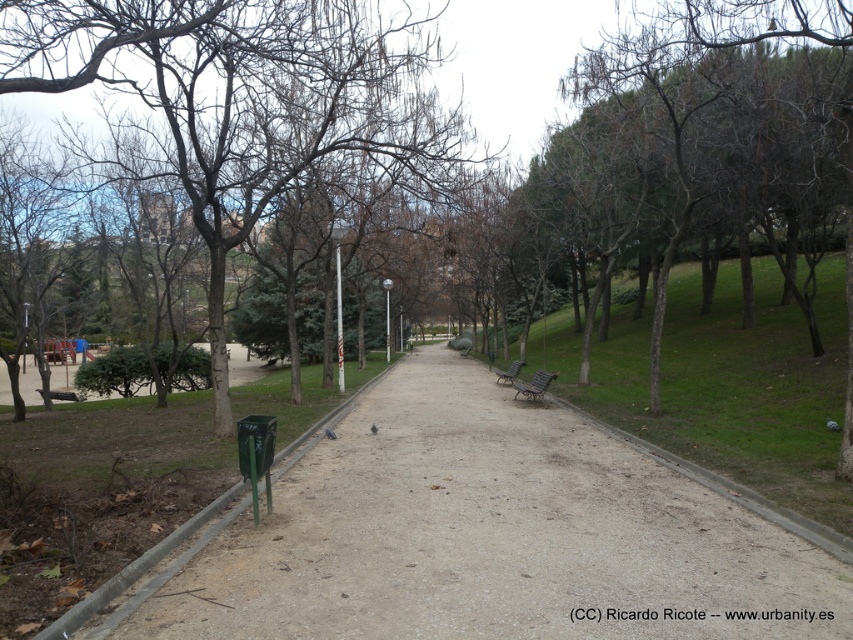
Does metallic silver bench at center appear over green metallic bench at center-right?

Incorrect, metallic silver bench at center is not positioned above green metallic bench at center-right.

Is point (537, 388) positioned before point (514, 364)?

Yes.

This screenshot has width=853, height=640. In order to click on metallic silver bench at center in this screenshot , I will do `click(534, 385)`.

Does brown leafless tree at center appear under green metallic bench at center-right?

Actually, brown leafless tree at center is above green metallic bench at center-right.

Between point (258, 42) and point (497, 371), which one is positioned behind?

The point (497, 371) is behind.

The width and height of the screenshot is (853, 640). I want to click on brown leafless tree at center, so click(247, 97).

What are the coordinates of `brown leafless tree at center` in the screenshot? It's located at (247, 97).

Which is more to the left, brown leafless tree at center or metallic silver bench at center?

brown leafless tree at center

Between point (129, 35) and point (517, 392), which one is positioned behind?

Positioned behind is point (517, 392).

The width and height of the screenshot is (853, 640). Identify the location of brown leafless tree at center. (247, 97).